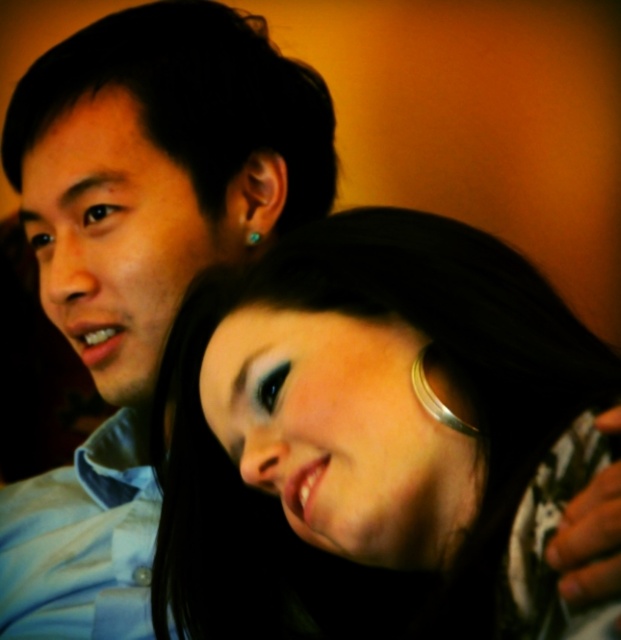
Question: Among these points, which one is nearest to the camera?

Choices:
 (A) (514, 340)
 (B) (57, 88)

Answer: (A)

Question: Which point is closer to the camera?

Choices:
 (A) (29, 77)
 (B) (156, 566)

Answer: (B)

Question: Does smooth silver necklace at center appear on the left side of matte blue shirt at left?

Choices:
 (A) yes
 (B) no

Answer: (B)

Question: Among these points, which one is nearest to the camera?

Choices:
 (A) (173, 220)
 (B) (527, 410)

Answer: (B)

Question: Is smooth silver necklace at center to the right of matte blue shirt at left from the viewer's perspective?

Choices:
 (A) yes
 (B) no

Answer: (A)

Question: Is smooth silver necklace at center below matte blue shirt at left?

Choices:
 (A) no
 (B) yes

Answer: (B)